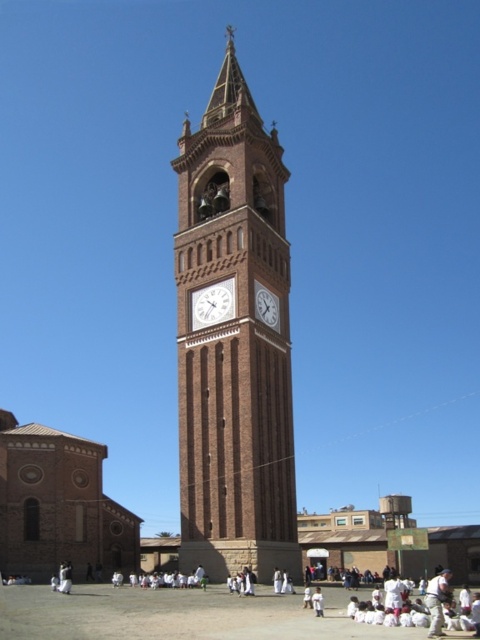
Does brown brick clock tower at center have a larger size compared to white glossy clock at center?

Indeed, brown brick clock tower at center has a larger size compared to white glossy clock at center.

The height and width of the screenshot is (640, 480). What are the coordinates of `brown brick clock tower at center` in the screenshot? It's located at (x=233, y=342).

What do you see at coordinates (233, 342) in the screenshot? I see `brown brick clock tower at center` at bounding box center [233, 342].

At what (x,y) coordinates should I click in order to perform the action: click on brown brick clock tower at center. Please return your answer as a coordinate pair (x, y). This screenshot has width=480, height=640. Looking at the image, I should click on (233, 342).

Does white glossy clock at center have a smaller size compared to brick clock tower at center?

Indeed, white glossy clock at center has a smaller size compared to brick clock tower at center.

Which is more to the right, white glossy clock at center or brick clock tower at center?

Positioned to the right is brick clock tower at center.

Find the location of a particular element. The image size is (480, 640). white glossy clock at center is located at coordinates (213, 305).

Who is more forward, (214, 154) or (261, 294)?

Point (261, 294) is in front.

From the picture: Can you confirm if brown brick clock tower at center is smaller than brick clock tower at center?

Incorrect, brown brick clock tower at center is not smaller in size than brick clock tower at center.

Between point (229, 161) and point (277, 328), which one is positioned behind?

Positioned behind is point (229, 161).

At what (x,y) coordinates should I click in order to perform the action: click on brown brick clock tower at center. Please return your answer as a coordinate pair (x, y). Looking at the image, I should click on (233, 342).